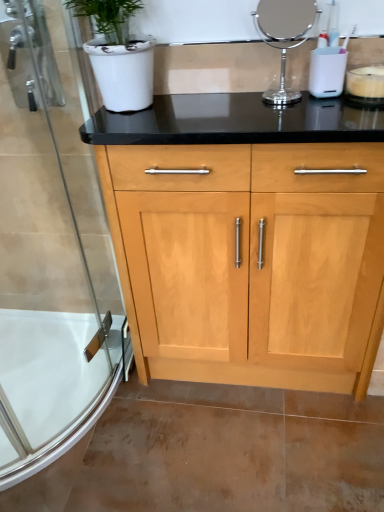
Question: From a real-world perspective, relative to white matte candle at upper right, is white glossy bath at lower left vertically above or below?

Choices:
 (A) above
 (B) below

Answer: (B)

Question: Is white glossy bath at lower left in front of or behind white matte candle at upper right in the image?

Choices:
 (A) behind
 (B) front

Answer: (A)

Question: Estimate the real-world distances between objects in this image. Which object is closer to the white matte candle at upper right?

Choices:
 (A) polished chrome mirror at upper center
 (B) white glossy bath at lower left
 (C) clear glass shower door at left

Answer: (A)

Question: Estimate the real-world distances between objects in this image. Which object is closer to the white matte candle at upper right?

Choices:
 (A) clear glass shower door at left
 (B) white glossy bath at lower left
 (C) polished chrome mirror at upper center

Answer: (C)